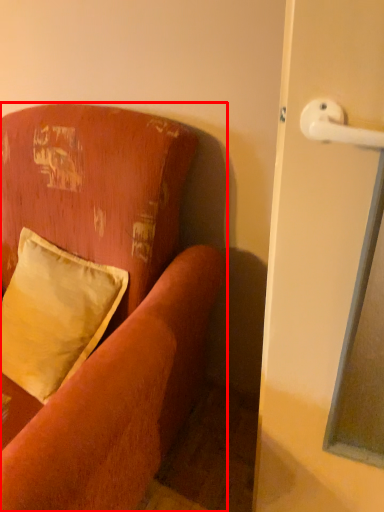
Question: From the image's perspective, what is the correct spatial positioning of studio couch (annotated by the red box) in reference to pillow?

Choices:
 (A) below
 (B) above

Answer: (A)